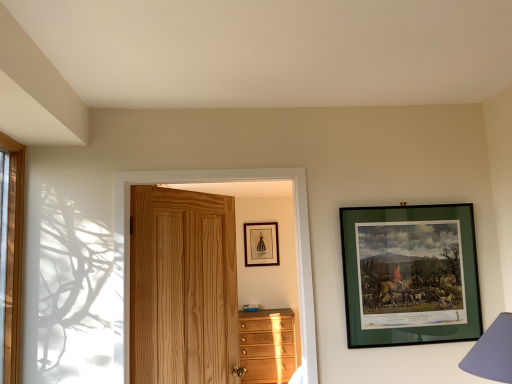
Identify the location of empty space that is ontop of natural wood door at center (from a real-world perspective). The image size is (512, 384). (221, 168).